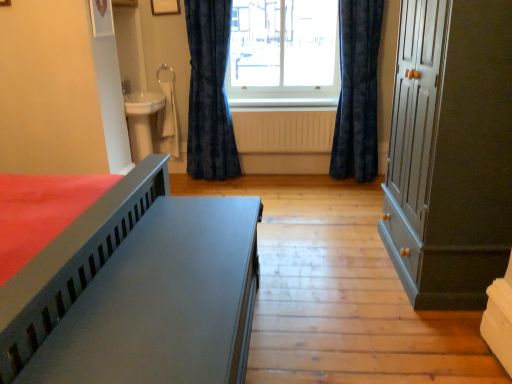
Question: From a real-world perspective, is velvet dark blue curtain at center, the 2th curtain when ordered from left to right, physically below matte gray bed at lower left?

Choices:
 (A) no
 (B) yes

Answer: (A)

Question: From a real-world perspective, is velvet dark blue curtain at center, positioned as the 1th curtain in right-to-left order, on top of matte gray bed at lower left?

Choices:
 (A) no
 (B) yes

Answer: (B)

Question: Is velvet dark blue curtain at center, the 2th curtain when ordered from left to right, facing towards matte gray bed at lower left?

Choices:
 (A) yes
 (B) no

Answer: (B)

Question: Can you confirm if velvet dark blue curtain at center, the 2th curtain when ordered from left to right, is bigger than matte gray bed at lower left?

Choices:
 (A) no
 (B) yes

Answer: (A)

Question: Does velvet dark blue curtain at center, positioned as the 1th curtain in right-to-left order, have a greater width compared to matte gray bed at lower left?

Choices:
 (A) yes
 (B) no

Answer: (B)

Question: Is point (343, 89) closer or farther from the camera than point (212, 9)?

Choices:
 (A) farther
 (B) closer

Answer: (A)

Question: Is velvet dark blue curtain at center, positioned as the 1th curtain in right-to-left order, in front of or behind velvet dark blue curtain at center, which is counted as the first curtain, starting from the left, in the image?

Choices:
 (A) behind
 (B) front

Answer: (B)

Question: Choose the correct answer: Is velvet dark blue curtain at center, positioned as the 1th curtain in right-to-left order, inside velvet dark blue curtain at center, which is the 2th curtain in right-to-left order, or outside it?

Choices:
 (A) outside
 (B) inside

Answer: (A)

Question: Is velvet dark blue curtain at center, positioned as the 1th curtain in right-to-left order, wider or thinner than velvet dark blue curtain at center, which is the 2th curtain in right-to-left order?

Choices:
 (A) wide
 (B) thin

Answer: (A)

Question: Would you say matte gray bed at lower left is inside or outside matte gray cupboard at right?

Choices:
 (A) inside
 (B) outside

Answer: (B)

Question: Visually, is matte gray bed at lower left positioned to the left or to the right of matte gray cupboard at right?

Choices:
 (A) right
 (B) left

Answer: (B)

Question: Does point (188, 347) appear closer or farther from the camera than point (392, 130)?

Choices:
 (A) closer
 (B) farther

Answer: (A)

Question: Is matte gray bed at lower left in front of or behind matte gray cupboard at right in the image?

Choices:
 (A) front
 (B) behind

Answer: (A)

Question: In terms of width, does velvet dark blue curtain at center, which is counted as the first curtain, starting from the left, look wider or thinner when compared to transparent glass window at center?

Choices:
 (A) thin
 (B) wide

Answer: (B)

Question: Is velvet dark blue curtain at center, which is the 2th curtain in right-to-left order, situated inside transparent glass window at center or outside?

Choices:
 (A) outside
 (B) inside

Answer: (A)